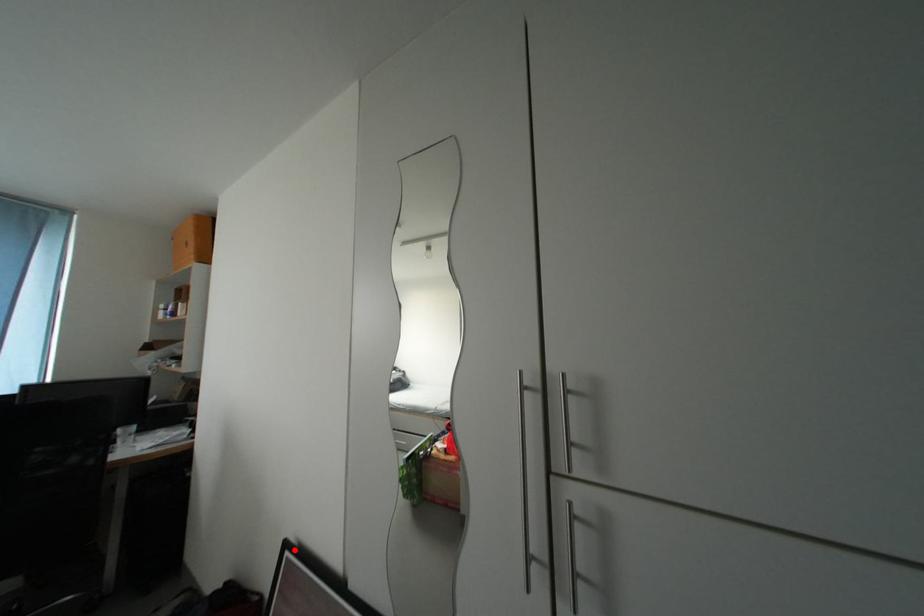
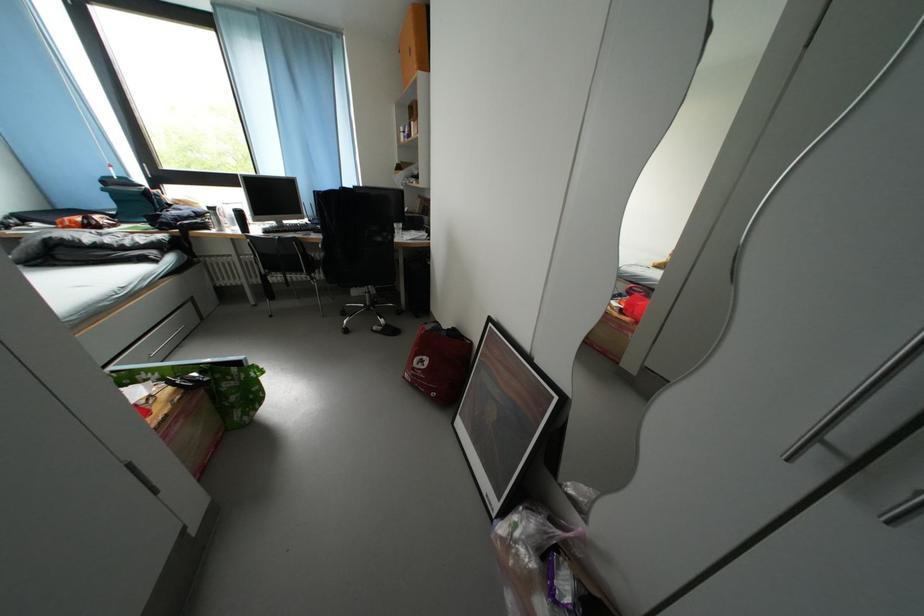
Where in the second image is the point corresponding to the highlighted location from the first image?

(497, 325)